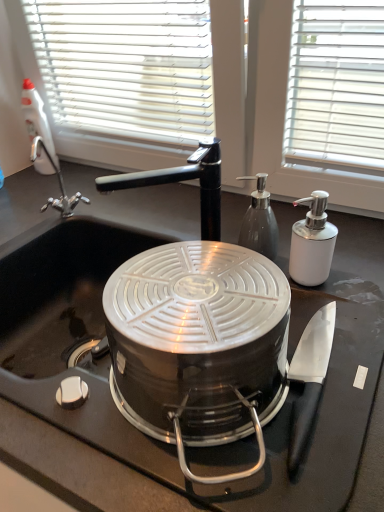
Locate an element on the screen. This screenshot has height=512, width=384. free location to the right of white glossy soap dispenser at right, marked as the second kitchen appliance in a left-to-right arrangement is located at coordinates (355, 279).